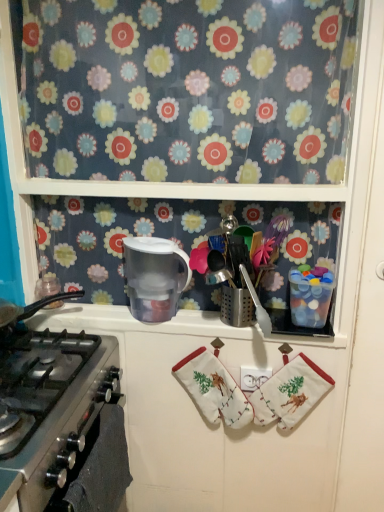
The image size is (384, 512). What do you see at coordinates (213, 388) in the screenshot? I see `white cotton hand towel at center, which ranks as the first hand towel in left-to-right order` at bounding box center [213, 388].

Locate an element on the screen. This screenshot has height=512, width=384. transparent plastic pitcher at upper center, the 1th appliance positioned from the left is located at coordinates (154, 277).

Where is `translucent plastic container at upper right, positioned as the 1th appliance in right-to-left order`? translucent plastic container at upper right, positioned as the 1th appliance in right-to-left order is located at coordinates (310, 298).

From the image's perspective, is white cotton hand towel at center, which ranks as the first hand towel in left-to-right order, above or below transparent plastic pitcher at upper center, arranged as the 2th appliance when viewed from the right?

From the image's perspective, white cotton hand towel at center, which ranks as the first hand towel in left-to-right order, appears below transparent plastic pitcher at upper center, arranged as the 2th appliance when viewed from the right.

Is white cotton hand towel at center, which is the second hand towel from right to left, oriented towards transparent plastic pitcher at upper center, arranged as the 2th appliance when viewed from the right?

No, white cotton hand towel at center, which is the second hand towel from right to left, is not turned towards transparent plastic pitcher at upper center, arranged as the 2th appliance when viewed from the right.

Can you confirm if white cotton hand towel at center, which is the second hand towel from right to left, is positioned to the right of transparent plastic pitcher at upper center, arranged as the 2th appliance when viewed from the right?

Yes, white cotton hand towel at center, which is the second hand towel from right to left, is to the right of transparent plastic pitcher at upper center, arranged as the 2th appliance when viewed from the right.

Is white cotton hand towel at center, which is the second hand towel from right to left, surrounding transparent plastic pitcher at upper center, arranged as the 2th appliance when viewed from the right?

That's incorrect, transparent plastic pitcher at upper center, arranged as the 2th appliance when viewed from the right, is not inside white cotton hand towel at center, which is the second hand towel from right to left.

Looking at this image, from the image's perspective, is transparent plastic pitcher at upper center, the 1th appliance positioned from the left, above or below silver metallic gas stove at lower left?

transparent plastic pitcher at upper center, the 1th appliance positioned from the left, is situated higher than silver metallic gas stove at lower left in the image.

Does transparent plastic pitcher at upper center, the 1th appliance positioned from the left, appear on the right side of silver metallic gas stove at lower left?

Correct, you'll find transparent plastic pitcher at upper center, the 1th appliance positioned from the left, to the right of silver metallic gas stove at lower left.

Which object is thinner, transparent plastic pitcher at upper center, the 1th appliance positioned from the left, or silver metallic gas stove at lower left?

transparent plastic pitcher at upper center, the 1th appliance positioned from the left, is thinner.

Does transparent plastic pitcher at upper center, the 1th appliance positioned from the left, lie in front of silver metallic gas stove at lower left?

No, transparent plastic pitcher at upper center, the 1th appliance positioned from the left, is further to the viewer.

Which of these two, black matte oven at lower left or white cotton hand towel at center, which is the first hand towel from right to left, is wider?

Wider between the two is white cotton hand towel at center, which is the first hand towel from right to left.

From a real-world perspective, between black matte oven at lower left and white cotton hand towel at center, the second hand towel from the left, who is vertically lower?

black matte oven at lower left is physically lower.

Between transparent plastic pitcher at upper center, arranged as the 2th appliance when viewed from the right, and translucent plastic container at upper right, acting as the 2th appliance starting from the left, which one has more height?

transparent plastic pitcher at upper center, arranged as the 2th appliance when viewed from the right.

From the image's perspective, is transparent plastic pitcher at upper center, arranged as the 2th appliance when viewed from the right, on translucent plastic container at upper right, positioned as the 1th appliance in right-to-left order?

Yes, from the image's perspective, transparent plastic pitcher at upper center, arranged as the 2th appliance when viewed from the right, is over translucent plastic container at upper right, positioned as the 1th appliance in right-to-left order.

Considering the positions of objects transparent plastic pitcher at upper center, the 1th appliance positioned from the left, and translucent plastic container at upper right, positioned as the 1th appliance in right-to-left order, in the image provided, who is in front, transparent plastic pitcher at upper center, the 1th appliance positioned from the left, or translucent plastic container at upper right, positioned as the 1th appliance in right-to-left order,?

translucent plastic container at upper right, positioned as the 1th appliance in right-to-left order.

Are transparent plastic pitcher at upper center, the 1th appliance positioned from the left, and translucent plastic container at upper right, positioned as the 1th appliance in right-to-left order, located far from each other?

No, there isn't a large distance between transparent plastic pitcher at upper center, the 1th appliance positioned from the left, and translucent plastic container at upper right, positioned as the 1th appliance in right-to-left order.

Who is more distant, floral fabric curtain at upper center or translucent plastic container at upper right, acting as the 2th appliance starting from the left?

translucent plastic container at upper right, acting as the 2th appliance starting from the left, is more distant.

Consider the image. Considering the relative sizes of floral fabric curtain at upper center and translucent plastic container at upper right, positioned as the 1th appliance in right-to-left order, in the image provided, is floral fabric curtain at upper center smaller than translucent plastic container at upper right, positioned as the 1th appliance in right-to-left order,?

No.

Between point (315, 4) and point (302, 285), which one is positioned in front?

Positioned in front is point (315, 4).

From a real-world perspective, is white cotton hand towel at center, the second hand towel from the left, physically above transparent plastic pitcher at upper center, arranged as the 2th appliance when viewed from the right?

No, from a real-world perspective, white cotton hand towel at center, the second hand towel from the left, is not over transparent plastic pitcher at upper center, arranged as the 2th appliance when viewed from the right

Do you think white cotton hand towel at center, which is the first hand towel from right to left, is within transparent plastic pitcher at upper center, the 1th appliance positioned from the left, or outside of it?

white cotton hand towel at center, which is the first hand towel from right to left, is outside transparent plastic pitcher at upper center, the 1th appliance positioned from the left.

Find the location of `appliance that appears on the left of white cotton hand towel at center, the second hand towel from the left`. appliance that appears on the left of white cotton hand towel at center, the second hand towel from the left is located at coordinates (154, 277).

What's the angular difference between translucent plastic container at upper right, acting as the 2th appliance starting from the left, and white cotton hand towel at center, which is the second hand towel from right to left,'s facing directions?

The angular difference between translucent plastic container at upper right, acting as the 2th appliance starting from the left, and white cotton hand towel at center, which is the second hand towel from right to left, is 8.62 degrees.

Can you confirm if translucent plastic container at upper right, positioned as the 1th appliance in right-to-left order, is taller than white cotton hand towel at center, which is the second hand towel from right to left?

No, translucent plastic container at upper right, positioned as the 1th appliance in right-to-left order, is not taller than white cotton hand towel at center, which is the second hand towel from right to left.

Between translucent plastic container at upper right, positioned as the 1th appliance in right-to-left order, and white cotton hand towel at center, which ranks as the first hand towel in left-to-right order, which one is positioned in front?

translucent plastic container at upper right, positioned as the 1th appliance in right-to-left order.

From the picture: Considering the positions of objects translucent plastic container at upper right, positioned as the 1th appliance in right-to-left order, and white cotton hand towel at center, which ranks as the first hand towel in left-to-right order, in the image provided, who is more to the left, translucent plastic container at upper right, positioned as the 1th appliance in right-to-left order, or white cotton hand towel at center, which ranks as the first hand towel in left-to-right order,?

white cotton hand towel at center, which ranks as the first hand towel in left-to-right order.

From the transparent plastic pitcher at upper center, arranged as the 2th appliance when viewed from the right, count 1st hand towels forward and point to it. Please provide its 2D coordinates.

[(213, 388)]

Locate an element on the screen. The width and height of the screenshot is (384, 512). gas stove that appears below the transparent plastic pitcher at upper center, the 1th appliance positioned from the left (from the image's perspective) is located at coordinates (50, 409).

When comparing their distances from translucent plastic water filter at center, does white cotton hand towel at center, which is the first hand towel from right to left, or white cotton hand towel at center, which is the second hand towel from right to left, seem closer?

Based on the image, white cotton hand towel at center, which is the second hand towel from right to left, appears to be nearer to translucent plastic water filter at center.

Estimate the real-world distances between objects in this image. Which object is further from white cotton hand towel at center, which is the second hand towel from right to left, white cotton hand towel at center, which is the first hand towel from right to left, or floral fabric curtain at upper center?

floral fabric curtain at upper center lies further to white cotton hand towel at center, which is the second hand towel from right to left, than the other object.

Based on their spatial positions, is floral fabric curtain at upper center or translucent plastic container at upper right, acting as the 2th appliance starting from the left, further from white cotton hand towel at center, which is the second hand towel from right to left?

The object further to white cotton hand towel at center, which is the second hand towel from right to left, is floral fabric curtain at upper center.

Estimate the real-world distances between objects in this image. Which object is closer to translucent plastic water filter at center, transparent plastic pitcher at upper center, arranged as the 2th appliance when viewed from the right, or black matte oven at lower left?

transparent plastic pitcher at upper center, arranged as the 2th appliance when viewed from the right, lies closer to translucent plastic water filter at center than the other object.

Considering their positions, is white cotton hand towel at center, which ranks as the first hand towel in left-to-right order, positioned closer to black matte oven at lower left than translucent plastic container at upper right, acting as the 2th appliance starting from the left?

white cotton hand towel at center, which ranks as the first hand towel in left-to-right order, lies closer to black matte oven at lower left than the other object.

Considering their positions, is black matte oven at lower left positioned further to transparent plastic pitcher at upper center, the 1th appliance positioned from the left, than white cotton hand towel at center, which is the second hand towel from right to left?

Among the two, black matte oven at lower left is located further to transparent plastic pitcher at upper center, the 1th appliance positioned from the left.

Based on their spatial positions, is floral fabric curtain at upper center or silver metallic gas stove at lower left closer to transparent plastic pitcher at upper center, arranged as the 2th appliance when viewed from the right?

Answer: silver metallic gas stove at lower left is closer to transparent plastic pitcher at upper center, arranged as the 2th appliance when viewed from the right.

Considering their positions, is black matte oven at lower left positioned closer to white cotton hand towel at center, which is the second hand towel from right to left, than translucent plastic container at upper right, positioned as the 1th appliance in right-to-left order?

black matte oven at lower left is closer to white cotton hand towel at center, which is the second hand towel from right to left.

You are a GUI agent. You are given a task and a screenshot of the screen. Output one action in this format:
    pyautogui.click(x=<x>, y=<y>)
    Task: Click on the hand towel between translucent plastic container at upper right, positioned as the 1th appliance in right-to-left order, and white cotton hand towel at center, which is the first hand towel from right to left, from top to bottom
    
    Given the screenshot: What is the action you would take?
    pyautogui.click(x=213, y=388)

Locate an element on the screen. The height and width of the screenshot is (512, 384). counter top between silver metallic gas stove at lower left and white cotton hand towel at center, which is the second hand towel from right to left, from left to right is located at coordinates (133, 322).

You are a GUI agent. You are given a task and a screenshot of the screen. Output one action in this format:
    pyautogui.click(x=<x>, y=<y>)
    Task: Click on the appliance between silver metallic gas stove at lower left and translucent plastic container at upper right, acting as the 2th appliance starting from the left, from left to right
    The image size is (384, 512).
    Given the screenshot: What is the action you would take?
    pyautogui.click(x=154, y=277)

Locate an element on the screen. Image resolution: width=384 pixels, height=512 pixels. hand towel between floral fabric curtain at upper center and white cotton hand towel at center, the second hand towel from the left, in the vertical direction is located at coordinates (213, 388).